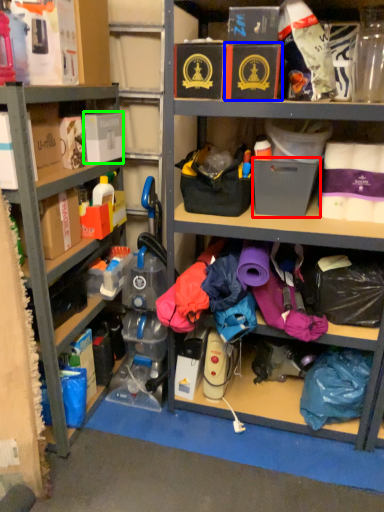
Question: Which object is positioned closest to storage box (highlighted by a red box)? Select from storage box (highlighted by a blue box) and storage box (highlighted by a green box).

Choices:
 (A) storage box
 (B) storage box

Answer: (A)